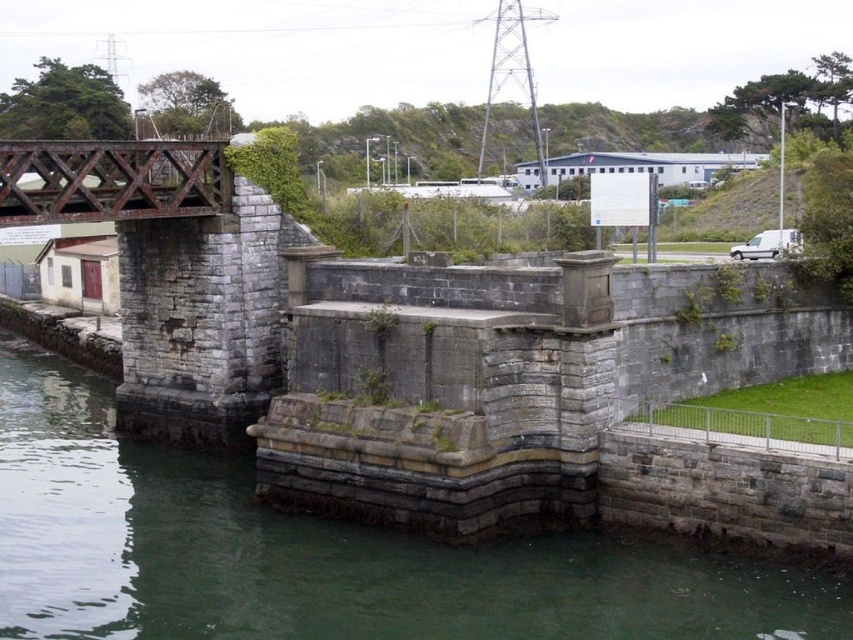
Question: Is gray stone wall at lower left smaller than rusty metal bridge at upper left?

Choices:
 (A) yes
 (B) no

Answer: (A)

Question: Observing the image, what is the correct spatial positioning of gray stone wall at lower left in reference to rusty metal bridge at upper left?

Choices:
 (A) below
 (B) above

Answer: (A)

Question: Where is gray stone wall at lower left located in relation to rusty metal bridge at upper left in the image?

Choices:
 (A) below
 (B) above

Answer: (A)